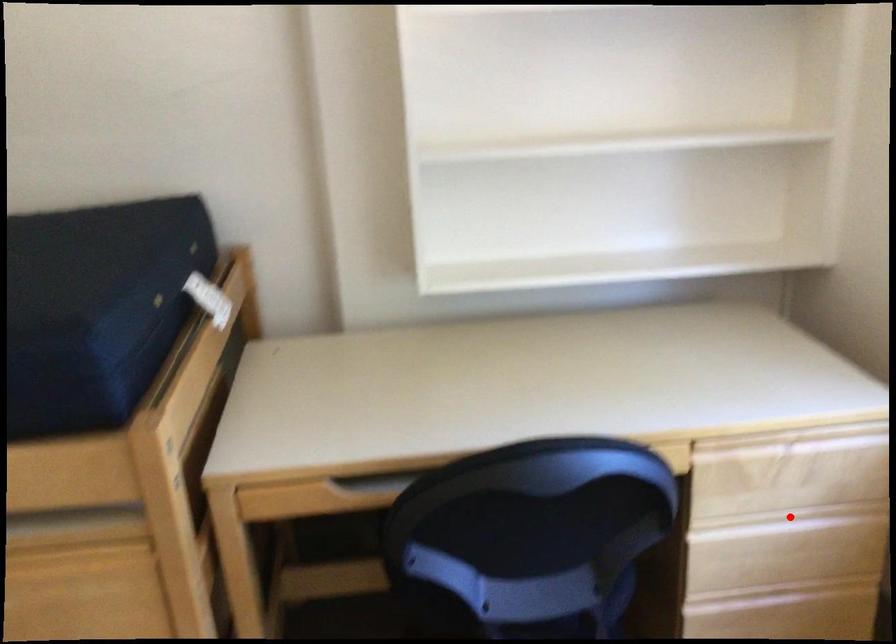
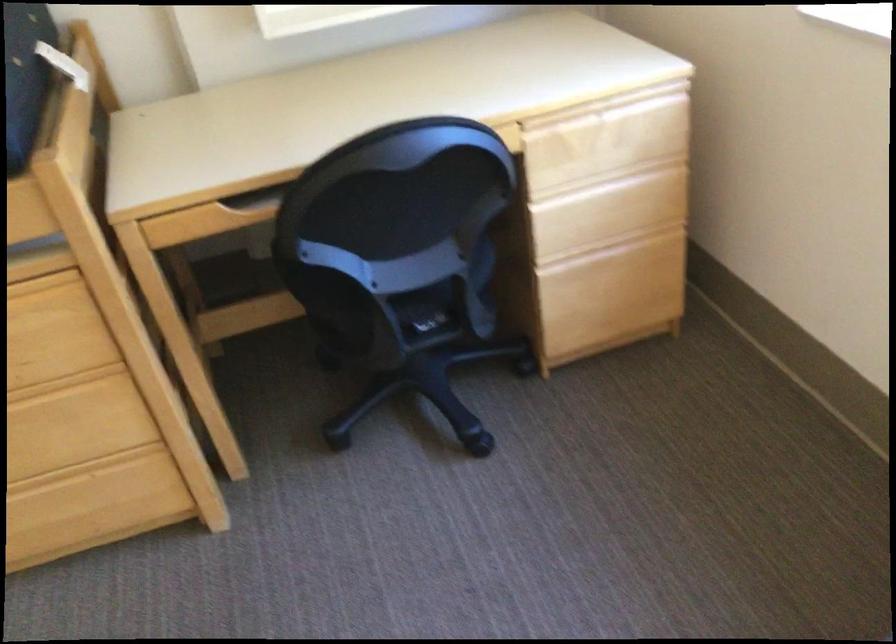
In the second image, find the point that corresponds to the highlighted location in the first image.

(607, 180)